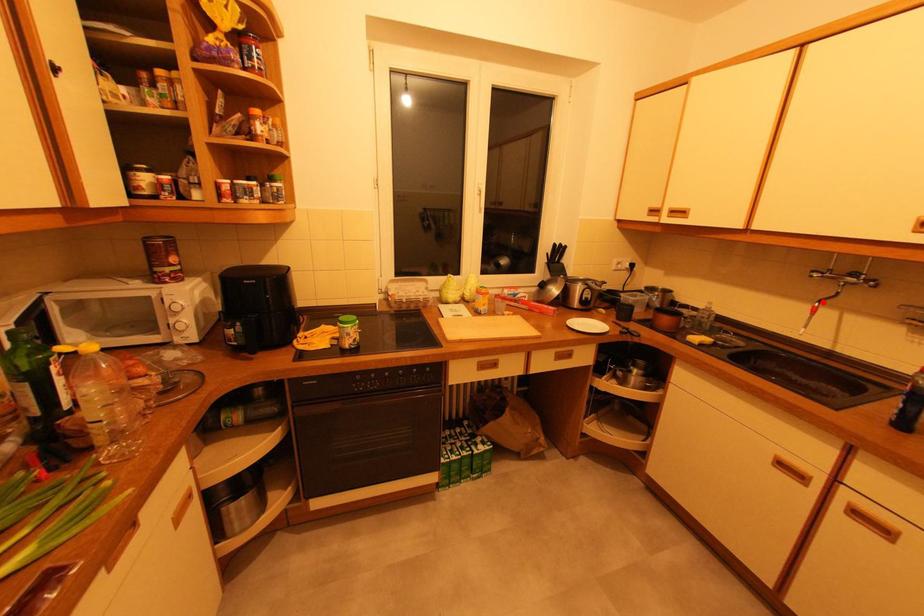
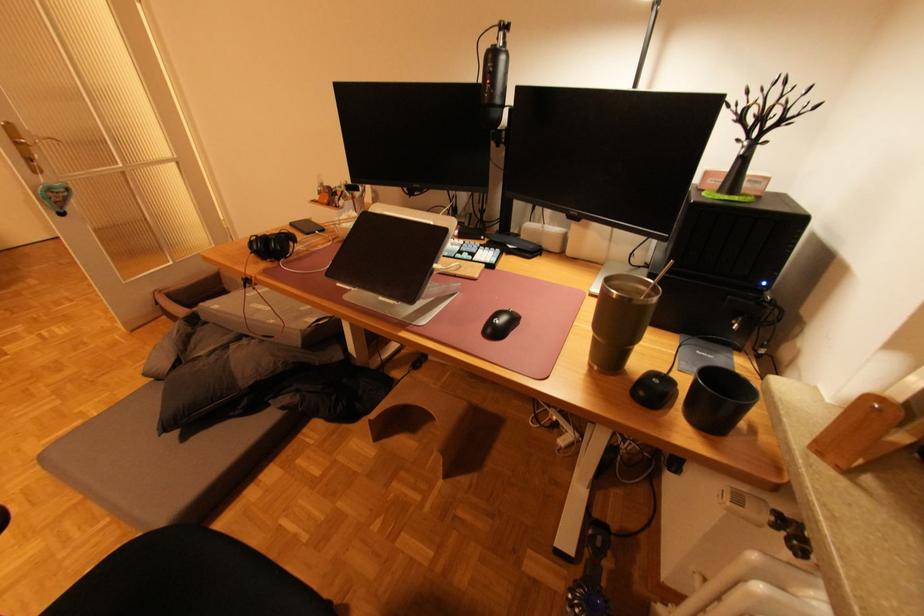
Question: I am providing you with two images of the same scene from different viewpoints. A red point is marked on the first image. Is the red point's position out of view in image 2?

Choices:
 (A) Yes
 (B) No

Answer: (A)